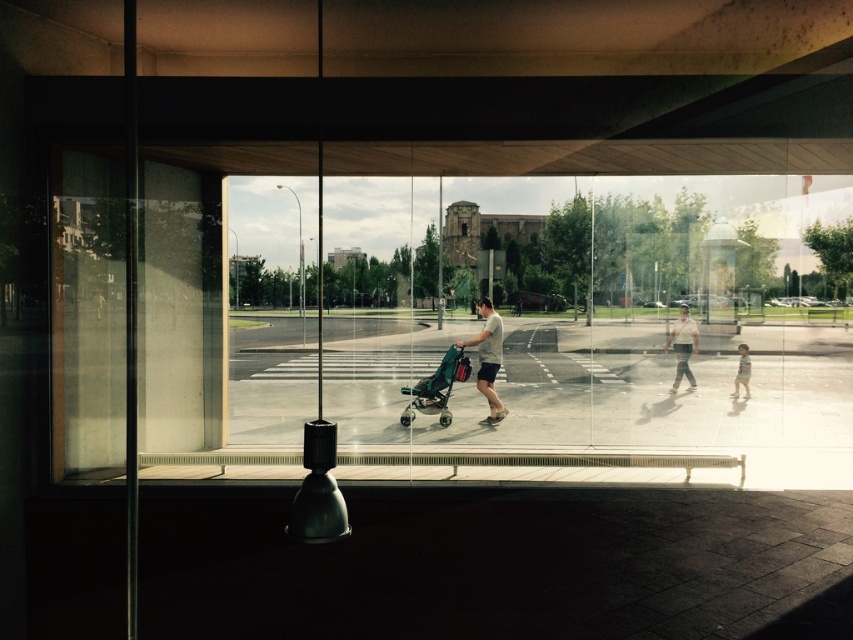
Can you confirm if teal fabric stroller at center is smaller than matte black skateboard at center?

Incorrect, teal fabric stroller at center is not smaller in size than matte black skateboard at center.

Who is more distant from viewer, (427,385) or (491,422)?

Point (491,422)

Where is `teal fabric stroller at center`? teal fabric stroller at center is located at coordinates (436, 387).

Who is lower down, matte gray t-shirt at center or wooden skateboard at lower right?

wooden skateboard at lower right is lower down.

Can you confirm if matte gray t-shirt at center is positioned below wooden skateboard at lower right?

Incorrect, matte gray t-shirt at center is not positioned below wooden skateboard at lower right.

This screenshot has width=853, height=640. Describe the element at coordinates (488, 358) in the screenshot. I see `matte gray t-shirt at center` at that location.

Where is `matte gray t-shirt at center`? The width and height of the screenshot is (853, 640). matte gray t-shirt at center is located at coordinates (488, 358).

Describe the element at coordinates (436, 387) in the screenshot. I see `teal fabric stroller at center` at that location.

Is teal fabric stroller at center below matte gray t-shirt at center?

Yes.

The width and height of the screenshot is (853, 640). What do you see at coordinates (436, 387) in the screenshot? I see `teal fabric stroller at center` at bounding box center [436, 387].

Identify the location of teal fabric stroller at center. The width and height of the screenshot is (853, 640). (436, 387).